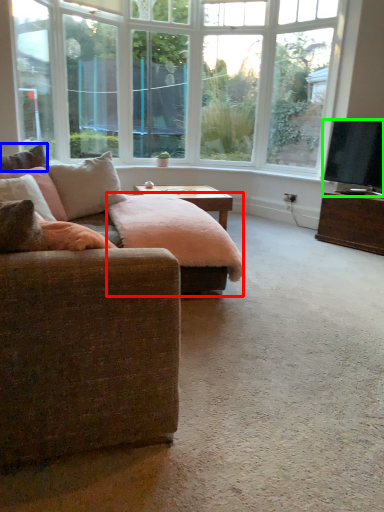
Question: Which is farther away from swivel chair (highlighted by a red box)? pillow (highlighted by a blue box) or television (highlighted by a green box)?

Choices:
 (A) pillow
 (B) television

Answer: (B)